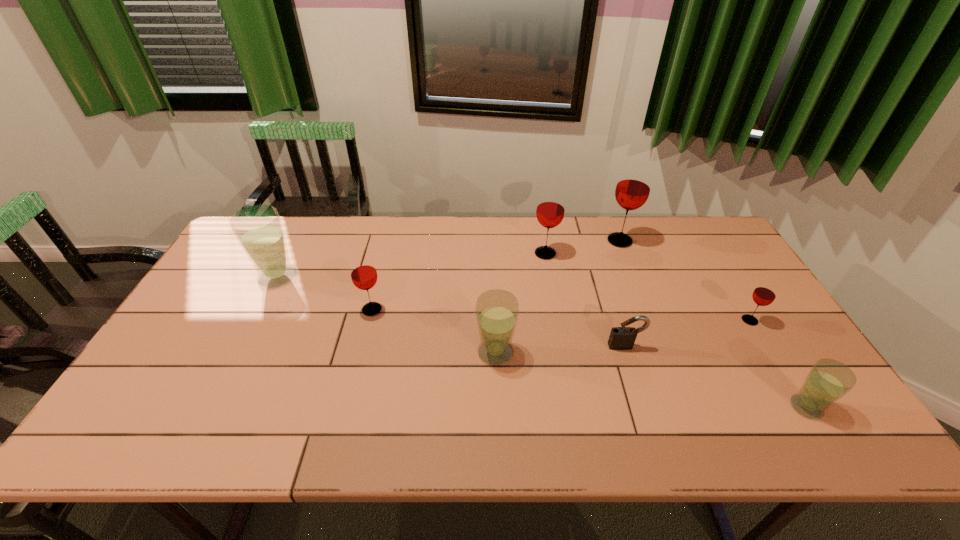
Find the location of a particular element. the tallest glass is located at coordinates (633, 187).

At what (x,y) coordinates should I click in order to perform the action: click on the tallest object. Please return your answer as a coordinate pair (x, y). The image size is (960, 540). Looking at the image, I should click on (633, 187).

You are a GUI agent. You are given a task and a screenshot of the screen. Output one action in this format:
    pyautogui.click(x=<x>, y=<y>)
    Task: Click on the third red glass from right to left
    This screenshot has width=960, height=540.
    Given the screenshot: What is the action you would take?
    pyautogui.click(x=550, y=211)

Find the location of a particular element. This screenshot has width=960, height=540. the third smallest red glass is located at coordinates (550, 211).

Identify the location of the farthest blue glass. The height and width of the screenshot is (540, 960). (258, 229).

Where is `the biggest blue glass`? the biggest blue glass is located at coordinates (258, 229).

This screenshot has height=540, width=960. Find the location of `the leftmost red glass`. the leftmost red glass is located at coordinates (363, 272).

The height and width of the screenshot is (540, 960). What are the coordinates of `the third biggest red glass` in the screenshot? It's located at (363, 272).

The height and width of the screenshot is (540, 960). In order to click on the second biggest blue glass in this screenshot , I will do [497, 310].

Locate an element on the screen. The height and width of the screenshot is (540, 960). the second blue glass from left to right is located at coordinates (497, 310).